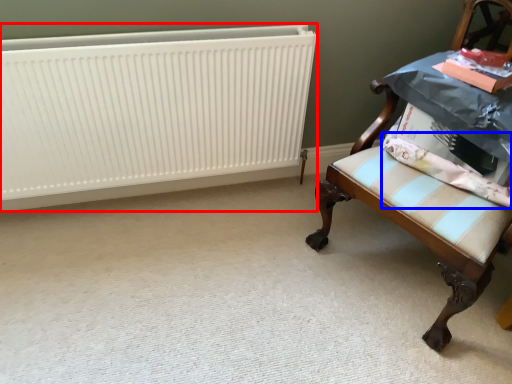
Question: Among these objects, which one is farthest to the camera, radiator (highlighted by a red box) or fabric (highlighted by a blue box)?

Choices:
 (A) radiator
 (B) fabric

Answer: (A)